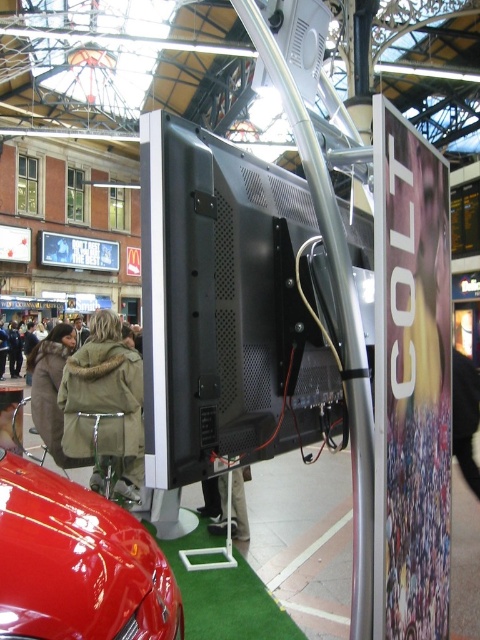
Between glossy red car at lower left and khaki fabric jacket at center, which one has more height?

glossy red car at lower left

Where is `glossy red car at lower left`? Image resolution: width=480 pixels, height=640 pixels. glossy red car at lower left is located at coordinates (78, 563).

Is khaki fur-lined coat at center positioned in front of khaki fabric jacket at center?

Yes, it is in front of khaki fabric jacket at center.

Is khaki fur-lined coat at center to the right of khaki fabric jacket at center from the viewer's perspective?

In fact, khaki fur-lined coat at center is to the left of khaki fabric jacket at center.

The height and width of the screenshot is (640, 480). Identify the location of khaki fur-lined coat at center. (106, 401).

Does glossy red car at lower left appear on the right side of khaki fur-lined coat at center?

Correct, you'll find glossy red car at lower left to the right of khaki fur-lined coat at center.

Can you confirm if glossy red car at lower left is bigger than khaki fur-lined coat at center?

Incorrect, glossy red car at lower left is not larger than khaki fur-lined coat at center.

Does point (27, 588) come closer to viewer compared to point (67, 362)?

Yes, point (27, 588) is closer to viewer.

The image size is (480, 640). What are the coordinates of `glossy red car at lower left` in the screenshot? It's located at (78, 563).